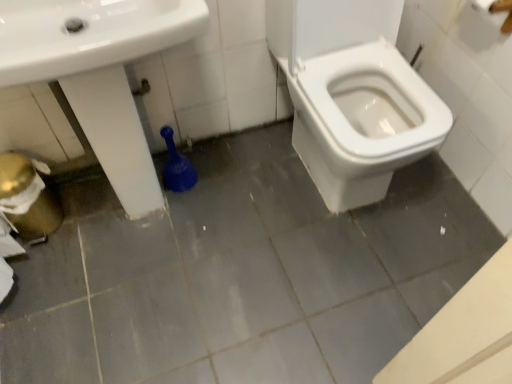
The image size is (512, 384). In order to click on unoccupied region to the right of white glossy sink at lower left in this screenshot , I will do `click(261, 211)`.